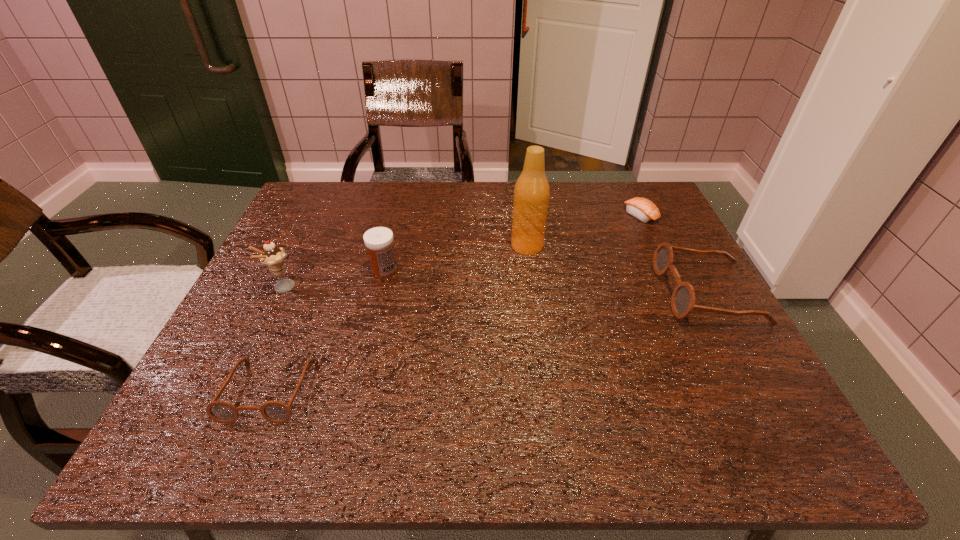
To achieve even spacing by inserting another spectacles among them, please point to a vacant spot for this new spectacles. Please provide its 2D coordinates. Your answer should be formatted as a tuple, i.e. [(x, y)], where the tuple contains the x and y coordinates of a point satisfying the conditions above.

[(512, 336)]